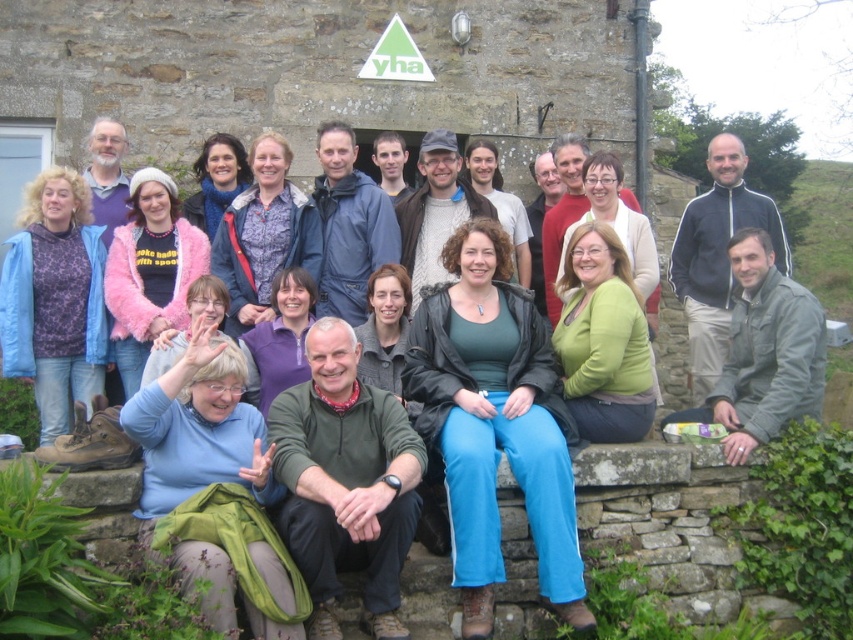
Question: Which point appears farthest from the camera in this image?

Choices:
 (A) (149, 401)
 (B) (639, 321)
 (C) (410, 282)
 (D) (393, 304)

Answer: (C)

Question: Is knitted sweater at center closer to the viewer compared to knitted gray sweater at center?

Choices:
 (A) yes
 (B) no

Answer: (B)

Question: Can you confirm if matte blue scarf at center is smaller than light brown sweater at center?

Choices:
 (A) no
 (B) yes

Answer: (A)

Question: Which object appears closest to the camera in this image?

Choices:
 (A) gray fabric jacket at lower right
 (B) blue fabric jacket at center

Answer: (A)

Question: Which of the following is the farthest from the observer?

Choices:
 (A) (218, 282)
 (B) (387, 148)
 (C) (523, 392)
 (D) (386, 291)

Answer: (B)

Question: Is blue fabric at center wider than knitted sweater at center?

Choices:
 (A) yes
 (B) no

Answer: (A)